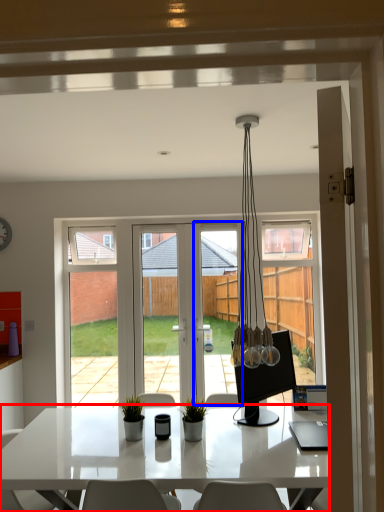
Question: Which object is further to the camera taking this photo, desk (highlighted by a red box) or screen door (highlighted by a blue box)?

Choices:
 (A) desk
 (B) screen door

Answer: (B)